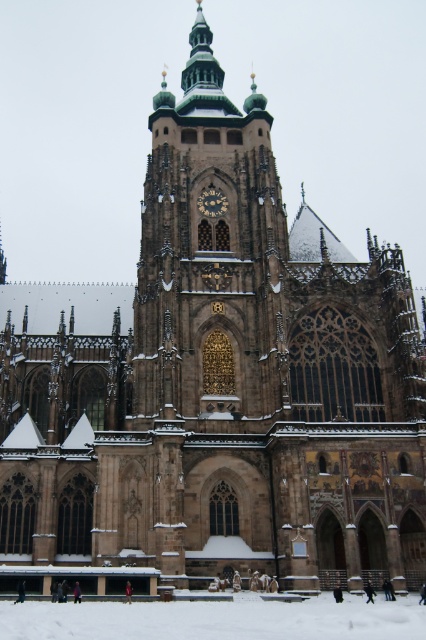
Question: Can you confirm if brown stone tower at center is wider than gold metallic clock at center?

Choices:
 (A) yes
 (B) no

Answer: (A)

Question: Which of these objects is positioned closest to the gold metallic clock at center?

Choices:
 (A) brown stone tower at center
 (B) white powdery snow at lower center

Answer: (A)

Question: Which point appears closest to the camera in this image?

Choices:
 (A) (414, 602)
 (B) (221, 236)

Answer: (A)

Question: Observing the image, what is the correct spatial positioning of white powdery snow at lower center in reference to gold metallic clock at center?

Choices:
 (A) right
 (B) left

Answer: (A)

Question: Which of the following is the closest to the observer?

Choices:
 (A) (181, 237)
 (B) (218, 620)

Answer: (B)

Question: Can you confirm if brown stone tower at center is smaller than white powdery snow at lower center?

Choices:
 (A) yes
 (B) no

Answer: (B)